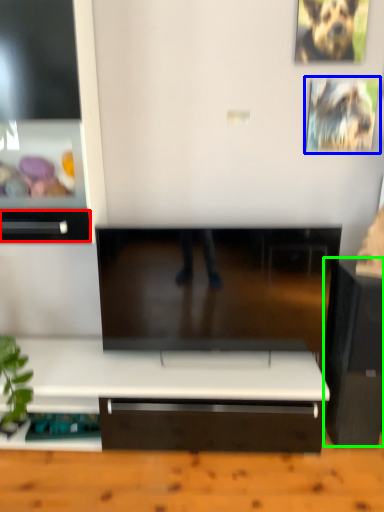
Question: Based on their relative distances, which object is nearer to drawer (highlighted by a red box)? Choose from picture frame (highlighted by a blue box) and furniture (highlighted by a green box).

Choices:
 (A) picture frame
 (B) furniture

Answer: (A)